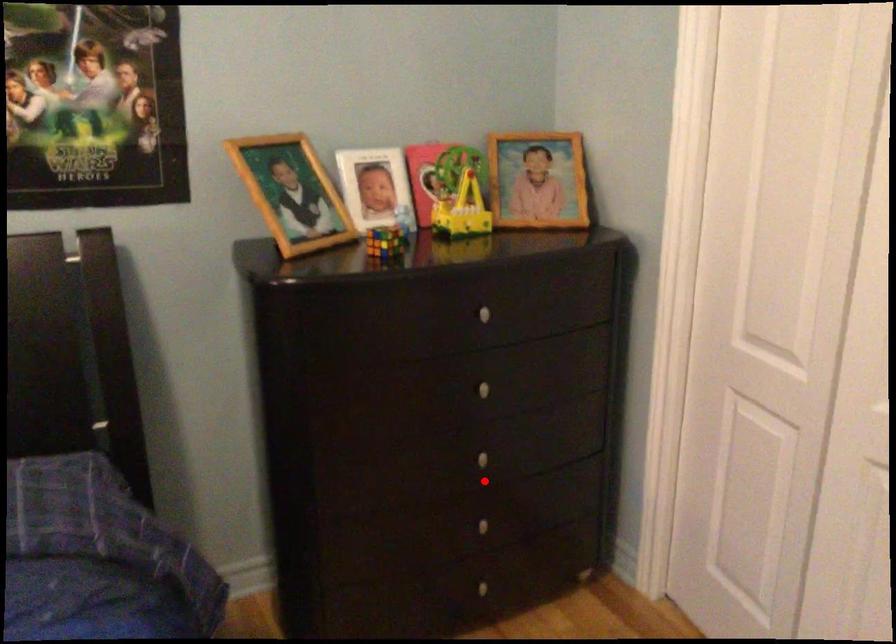
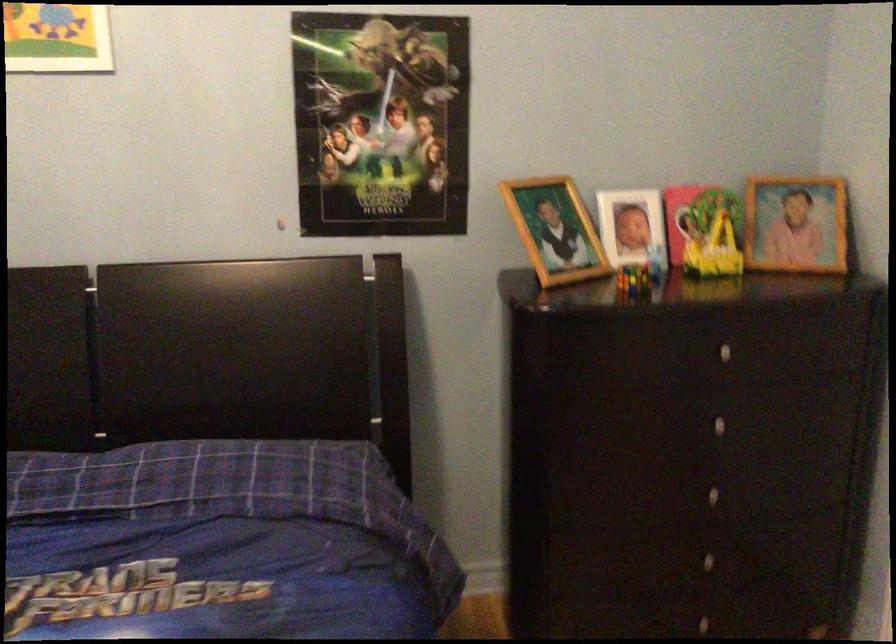
Question: I am providing you with two images of the same scene from different viewpoints. A red point is marked on the first image. Is the red point's position out of view in image 2?

Choices:
 (A) Yes
 (B) No

Answer: (B)